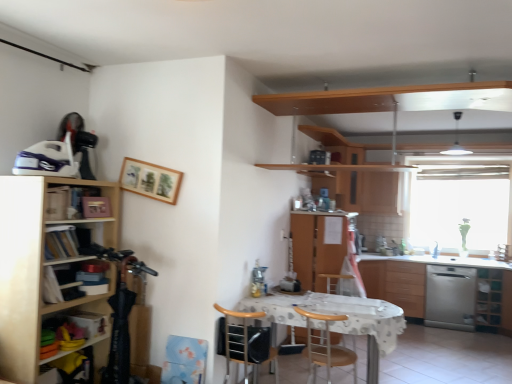
Question: Should I look upward or downward to see wooden chair at center, positioned as the 2th chair in right-to-left order?

Choices:
 (A) down
 (B) up

Answer: (A)

Question: Would you say wooden chair at center, which is counted as the 1th chair, starting from the left, is part of stainless steel dishwasher at right's contents?

Choices:
 (A) no
 (B) yes

Answer: (A)

Question: Can you confirm if stainless steel dishwasher at right is smaller than wooden chair at center, positioned as the 2th chair in right-to-left order?

Choices:
 (A) no
 (B) yes

Answer: (A)

Question: Is stainless steel dishwasher at right bigger than wooden chair at center, positioned as the 2th chair in right-to-left order?

Choices:
 (A) no
 (B) yes

Answer: (B)

Question: Considering the relative sizes of stainless steel dishwasher at right and wooden chair at center, positioned as the 2th chair in right-to-left order, in the image provided, is stainless steel dishwasher at right shorter than wooden chair at center, positioned as the 2th chair in right-to-left order,?

Choices:
 (A) no
 (B) yes

Answer: (A)

Question: Does stainless steel dishwasher at right touch wooden chair at center, which is counted as the 1th chair, starting from the left?

Choices:
 (A) yes
 (B) no

Answer: (B)

Question: From the image's perspective, is stainless steel dishwasher at right on wooden chair at center, positioned as the 2th chair in right-to-left order?

Choices:
 (A) yes
 (B) no

Answer: (B)

Question: Does stainless steel dishwasher at right have a greater width compared to wooden books at left?

Choices:
 (A) no
 (B) yes

Answer: (B)

Question: From the image's perspective, does stainless steel dishwasher at right appear higher than wooden books at left?

Choices:
 (A) yes
 (B) no

Answer: (B)

Question: Is stainless steel dishwasher at right thinner than wooden books at left?

Choices:
 (A) no
 (B) yes

Answer: (A)

Question: Is stainless steel dishwasher at right at the left side of wooden books at left?

Choices:
 (A) yes
 (B) no

Answer: (B)

Question: Is stainless steel dishwasher at right positioned before wooden books at left?

Choices:
 (A) yes
 (B) no

Answer: (B)

Question: Are stainless steel dishwasher at right and wooden books at left located far from each other?

Choices:
 (A) yes
 (B) no

Answer: (A)

Question: Is brown wood chair at center, marked as the first chair in a right-to-left arrangement, facing away from green glass cabinet at lower right, the 1th cabinet when ordered from back to front?

Choices:
 (A) no
 (B) yes

Answer: (A)